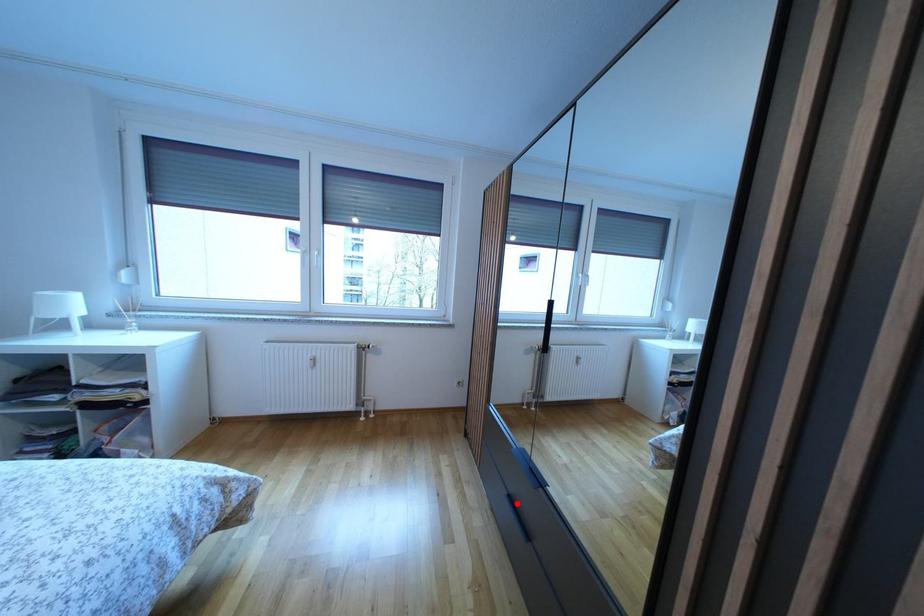
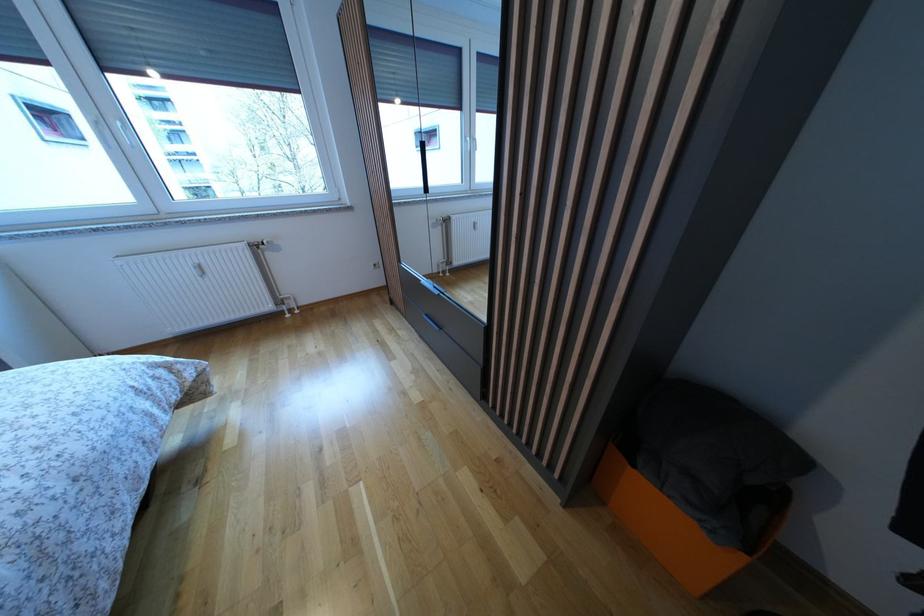
Where in the second image is the point corresponding to the highlighted location from the first image?

(433, 321)